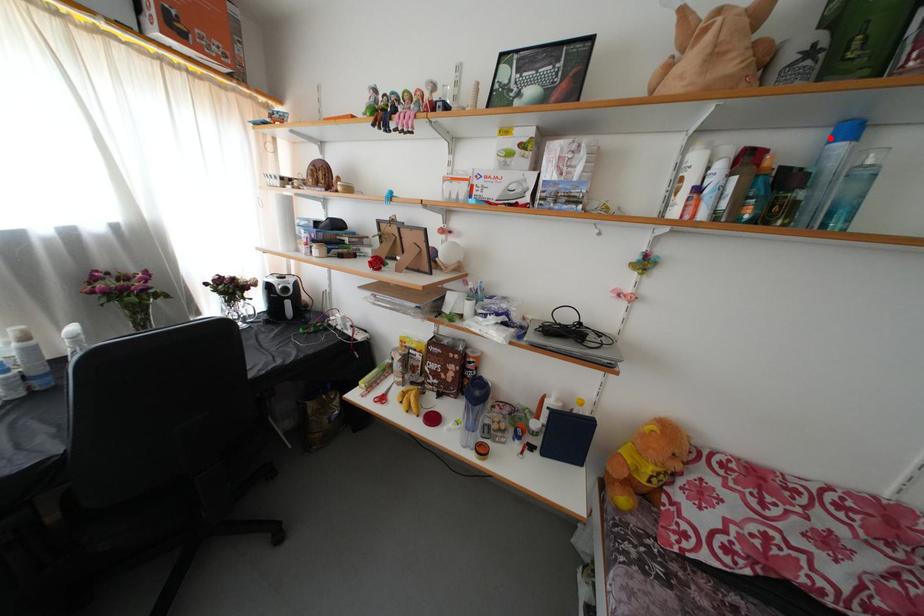
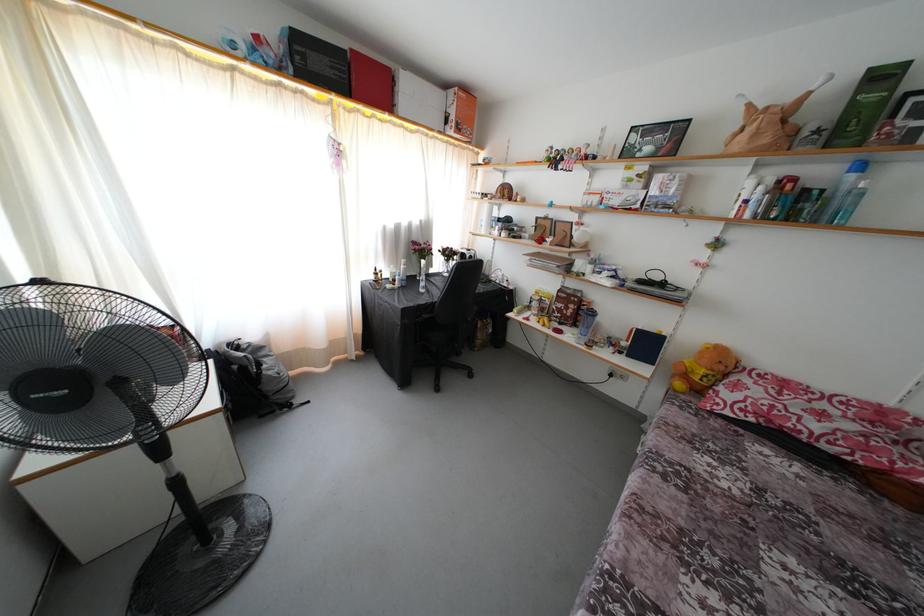
Find the pixel in the second image that matches the highlighted location in the first image.

(849, 172)